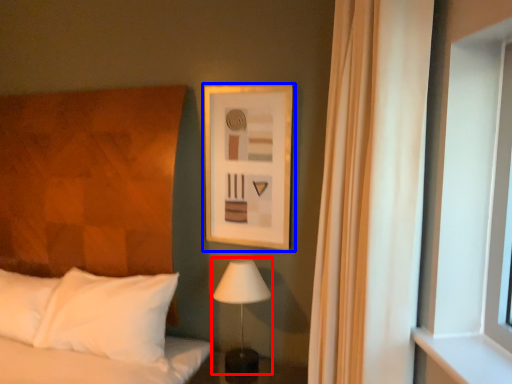
Question: Which point is further to the camera, table lamp (highlighted by a red box) or picture frame (highlighted by a blue box)?

Choices:
 (A) table lamp
 (B) picture frame

Answer: (B)